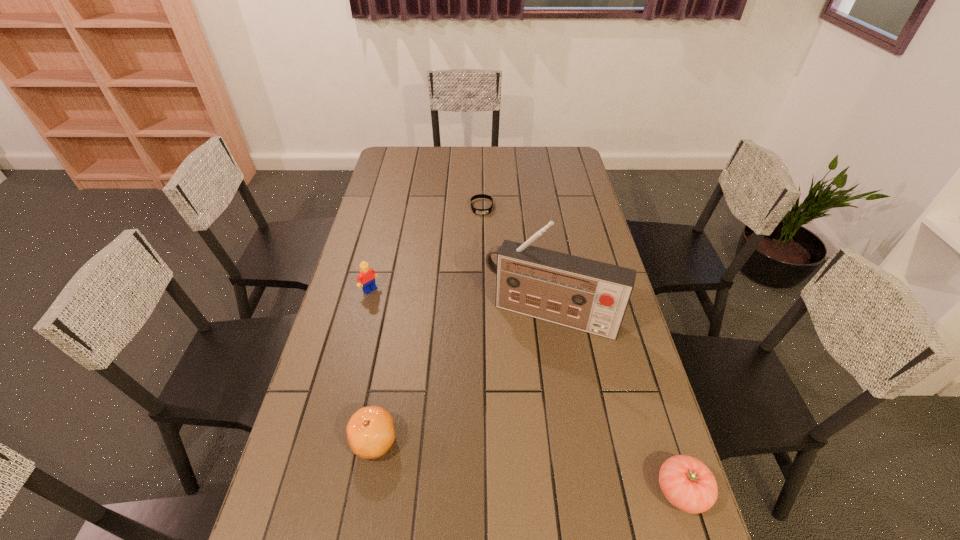
Identify the location of vacant spot on the desktop that is between the fourth object from right to left and the tomato and is positioned on the display of the shortest object. The width and height of the screenshot is (960, 540). (492, 460).

The height and width of the screenshot is (540, 960). In order to click on free space on the desktop that is between the clementine and the tomato and is positioned on the front panel of the radio receiver in this screenshot , I will do `click(501, 462)`.

This screenshot has height=540, width=960. Find the location of `vacant space on the desktop that is between the second object from left to right and the tomato and is positioned on the face of the leftmost object`. vacant space on the desktop that is between the second object from left to right and the tomato and is positioned on the face of the leftmost object is located at coordinates (565, 472).